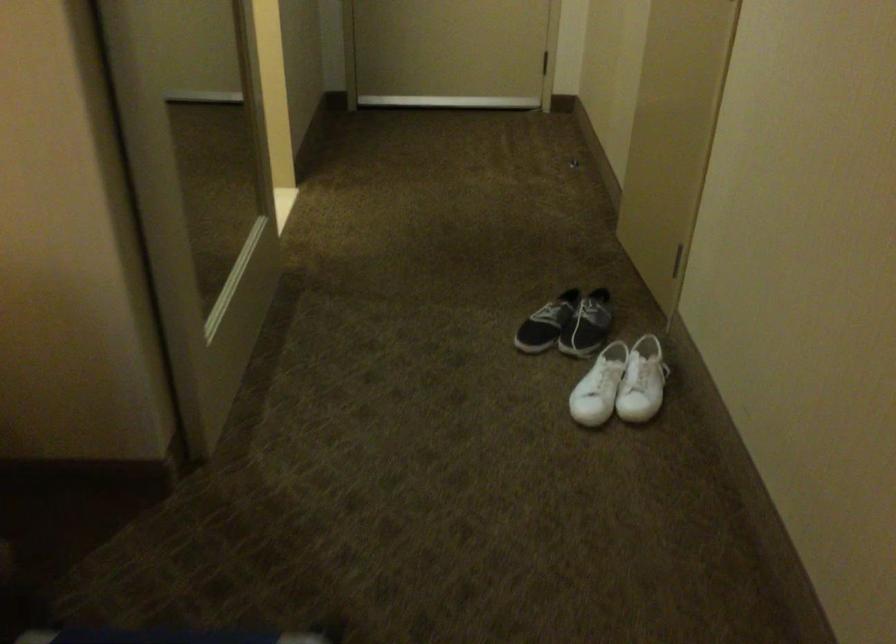
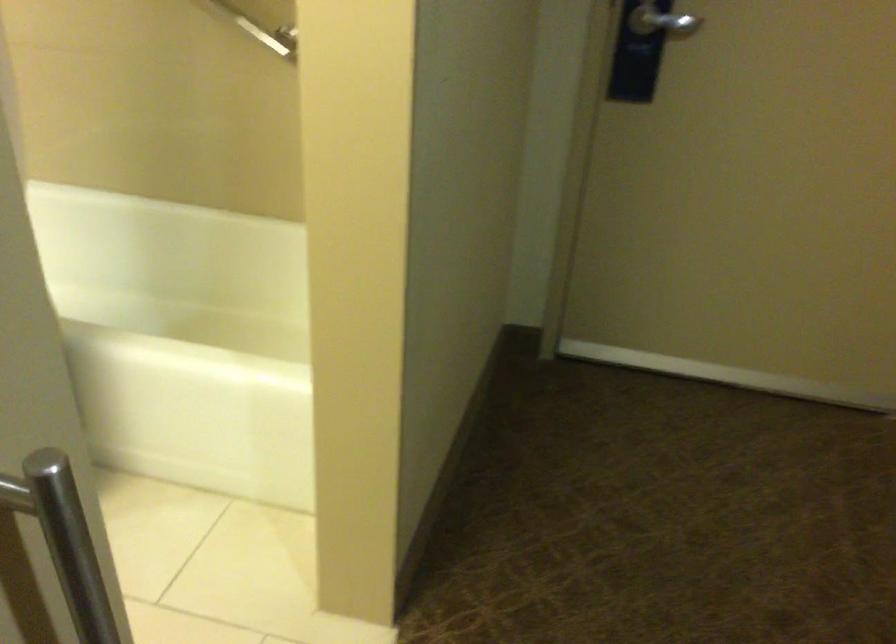
Question: In a continuous first-person perspective shot, in which direction is the camera moving?

Choices:
 (A) Left
 (B) Right
 (C) Forward
 (D) Backward

Answer: (C)